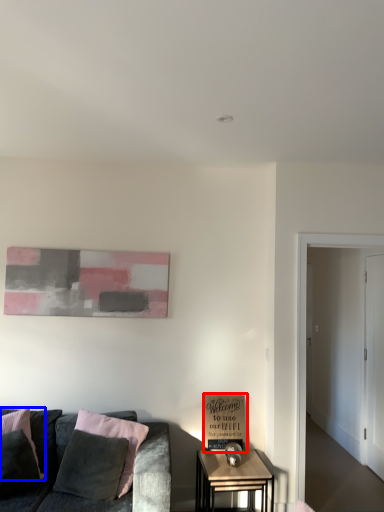
Question: Which of the following is the farthest to the observer, cardboard box (highlighted by a red box) or pillow (highlighted by a blue box)?

Choices:
 (A) cardboard box
 (B) pillow

Answer: (A)